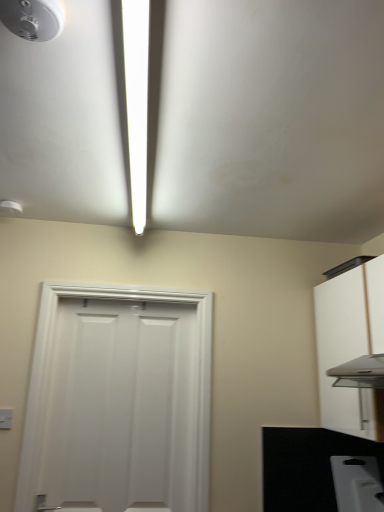
Describe the element at coordinates (33, 18) in the screenshot. I see `white plastic smoke detector at upper left` at that location.

This screenshot has width=384, height=512. What do you see at coordinates (6, 419) in the screenshot?
I see `white plastic light switch at lower left` at bounding box center [6, 419].

The width and height of the screenshot is (384, 512). Identify the location of white plastic light switch at lower left. (6, 419).

Measure the distance between point [325,502] and camera.

Point [325,502] and camera are 2.06 meters apart from each other.

The image size is (384, 512). In order to click on black matte countertop at lower right in this screenshot , I will do `click(306, 466)`.

This screenshot has height=512, width=384. In order to click on white plastic toaster at lower right in this screenshot , I will do `click(357, 483)`.

From a real-world perspective, between white matte door at center and white glossy light fixture at upper center, who is vertically higher?

In real-world perspective, white glossy light fixture at upper center is above.

Considering the relative sizes of white matte door at center and white glossy light fixture at upper center in the image provided, is white matte door at center thinner than white glossy light fixture at upper center?

Indeed, white matte door at center has a lesser width compared to white glossy light fixture at upper center.

Considering the positions of point (76, 430) and point (140, 52), is point (76, 430) closer or farther from the camera than point (140, 52)?

Point (76, 430) appears to be farther away from the viewer than point (140, 52).

Considering the relative sizes of white matte door at center and white glossy light fixture at upper center in the image provided, is white matte door at center shorter than white glossy light fixture at upper center?

No, white matte door at center is not shorter than white glossy light fixture at upper center.

Is black matte countertop at lower right looking in the opposite direction of white plastic light switch at lower left?

No, black matte countertop at lower right's orientation is not away from white plastic light switch at lower left.

Between black matte countertop at lower right and white plastic light switch at lower left, which one appears on the left side from the viewer's perspective?

white plastic light switch at lower left is more to the left.

From a real-world perspective, is black matte countertop at lower right over white plastic light switch at lower left?

No, from a real-world perspective, black matte countertop at lower right is not on top of white plastic light switch at lower left.

Between black matte countertop at lower right and white plastic light switch at lower left, which one has larger width?

Wider between the two is black matte countertop at lower right.

Considering the relative sizes of black matte countertop at lower right and white matte door at center in the image provided, is black matte countertop at lower right wider than white matte door at center?

No, black matte countertop at lower right is not wider than white matte door at center.

From the image's perspective, relative to white matte door at center, is black matte countertop at lower right above or below?

black matte countertop at lower right is below white matte door at center.

Is point (269, 498) positioned after point (187, 480)?

No, it is not.

Does black matte countertop at lower right have a greater height compared to white matte door at center?

In fact, black matte countertop at lower right may be shorter than white matte door at center.

Are white plastic light switch at lower left and white glossy light fixture at upper center located far from each other?

Absolutely, white plastic light switch at lower left is distant from white glossy light fixture at upper center.

Does white plastic light switch at lower left have a greater height compared to white glossy light fixture at upper center?

In fact, white plastic light switch at lower left may be shorter than white glossy light fixture at upper center.

Is white plastic light switch at lower left oriented away from white glossy light fixture at upper center?

No, white glossy light fixture at upper center is not at the back of white plastic light switch at lower left.

Between white plastic light switch at lower left and white glossy light fixture at upper center, which one has smaller size?

With smaller size is white plastic light switch at lower left.

Can you tell me how much white glossy light fixture at upper center and white matte cabinet at right differ in facing direction?

They differ by 88.4 degrees in their facing directions.

From the image's perspective, which object appears higher, white glossy light fixture at upper center or white matte cabinet at right?

white glossy light fixture at upper center is shown above in the image.

Between white glossy light fixture at upper center and white matte cabinet at right, which one is positioned behind?

white matte cabinet at right is more distant.

Is white glossy light fixture at upper center thinner than white matte cabinet at right?

No, white glossy light fixture at upper center is not thinner than white matte cabinet at right.

Could you measure the distance between white glossy light fixture at upper center and black matte countertop at lower right?

The distance of white glossy light fixture at upper center from black matte countertop at lower right is 1.48 meters.

From the image's perspective, between white glossy light fixture at upper center and black matte countertop at lower right, which one is located above?

white glossy light fixture at upper center is shown above in the image.

What's the angular difference between white glossy light fixture at upper center and black matte countertop at lower right's facing directions?

The angle between the facing direction of white glossy light fixture at upper center and the facing direction of black matte countertop at lower right is 1.03 degrees.

Does white glossy light fixture at upper center have a smaller size compared to black matte countertop at lower right?

Actually, white glossy light fixture at upper center might be larger than black matte countertop at lower right.

How different are the orientations of white plastic smoke detector at upper left and white matte cabinet at right in degrees?

They differ by 90.3 degrees in their facing directions.

From a real-world perspective, which object stands above the other?

white plastic smoke detector at upper left is physically above.

Is white plastic smoke detector at upper left shorter than white matte cabinet at right?

Indeed, white plastic smoke detector at upper left has a lesser height compared to white matte cabinet at right.

Where is `light fixture lying on the right of white matte door at center`? light fixture lying on the right of white matte door at center is located at coordinates (137, 101).

I want to click on light switch above the black matte countertop at lower right (from a real-world perspective), so click(6, 419).

Based on their spatial positions, is white plastic smoke detector at upper left or white matte cabinet at right closer to white glossy light fixture at upper center?

white plastic smoke detector at upper left is closer to white glossy light fixture at upper center.

When comparing their distances from white plastic light switch at lower left, does white plastic smoke detector at upper left or white glossy light fixture at upper center seem further?

white plastic smoke detector at upper left.

Based on their spatial positions, is white matte door at center or black matte countertop at lower right further from white plastic light switch at lower left?

Based on the image, black matte countertop at lower right appears to be further to white plastic light switch at lower left.

In the scene shown: When comparing their distances from black matte countertop at lower right, does white matte cabinet at right or white glossy light fixture at upper center seem further?

The object further to black matte countertop at lower right is white glossy light fixture at upper center.

From the image, which object appears to be nearer to white plastic light switch at lower left, white glossy light fixture at upper center or white matte cabinet at right?

The object closer to white plastic light switch at lower left is white glossy light fixture at upper center.

Considering their positions, is white glossy light fixture at upper center positioned further to white matte cabinet at right than white matte door at center?

The object further to white matte cabinet at right is white glossy light fixture at upper center.

From the image, which object appears to be nearer to white plastic toaster at lower right, white plastic light switch at lower left or white matte cabinet at right?

white matte cabinet at right is closer to white plastic toaster at lower right.

Estimate the real-world distances between objects in this image. Which object is closer to white plastic light switch at lower left, white matte cabinet at right or white plastic smoke detector at upper left?

Among the two, white matte cabinet at right is located nearer to white plastic light switch at lower left.

You are a GUI agent. You are given a task and a screenshot of the screen. Output one action in this format:
    pyautogui.click(x=<x>, y=<y>)
    Task: Click on the door situated between white plastic smoke detector at upper left and white matte cabinet at right from left to right
    The image size is (384, 512).
    Given the screenshot: What is the action you would take?
    pyautogui.click(x=127, y=399)

What are the coordinates of `appliance situated between white plastic light switch at lower left and white matte cabinet at right from left to right` in the screenshot? It's located at (357, 483).

Locate an element on the screen. light fixture situated between white matte door at center and white matte cabinet at right from left to right is located at coordinates (137, 101).

This screenshot has width=384, height=512. In order to click on droplight between white plastic light switch at lower left and white matte cabinet at right in the horizontal direction in this screenshot , I will do `click(33, 18)`.